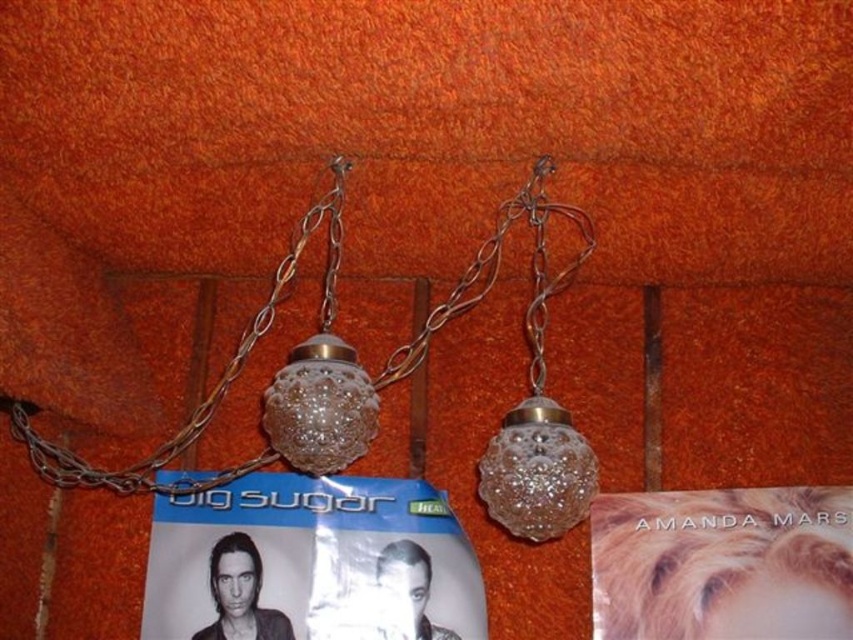
You are an interior designer assessing the wall decorations. You notice the matte paper poster at center and the clear glass globe at center. Which object is closer to the viewer?

The matte paper poster at center is closer to the viewer because the clear glass globe at center is behind it.

You are an interior designer assessing the wall decorations in a client room. You see a matte paper poster at center and a clear glass globe at center. Which object is positioned lower on the wall?

The matte paper poster at center is positioned lower on the wall because it is below the clear glass globe at center.

You are an interior designer assessing the wall decor. You notice the clear glass globe at center and the metallic chain at left. Which object would require more space if you were to replace it with a larger version?

The metallic chain at left would require more space if replaced with a larger version since the clear glass globe at center is currently smaller than it.